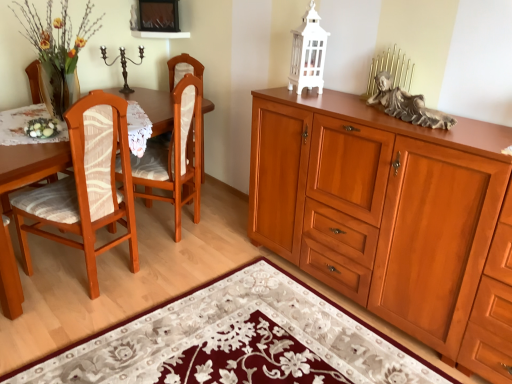
In order to click on vacant space to the right of wooden chair at left, which is the 2th chair from front to back in this screenshot , I will do `click(221, 230)`.